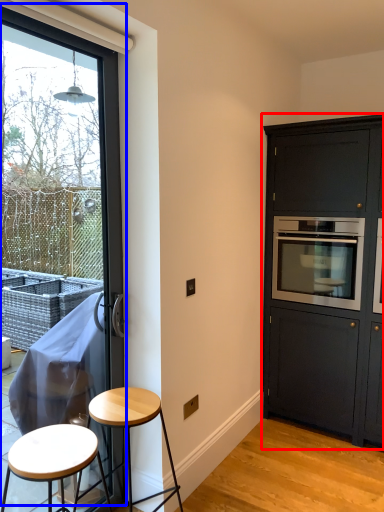
Question: Which object appears closest to the camera in this image, cabinetry (highlighted by a red box) or window (highlighted by a blue box)?

Choices:
 (A) cabinetry
 (B) window

Answer: (B)